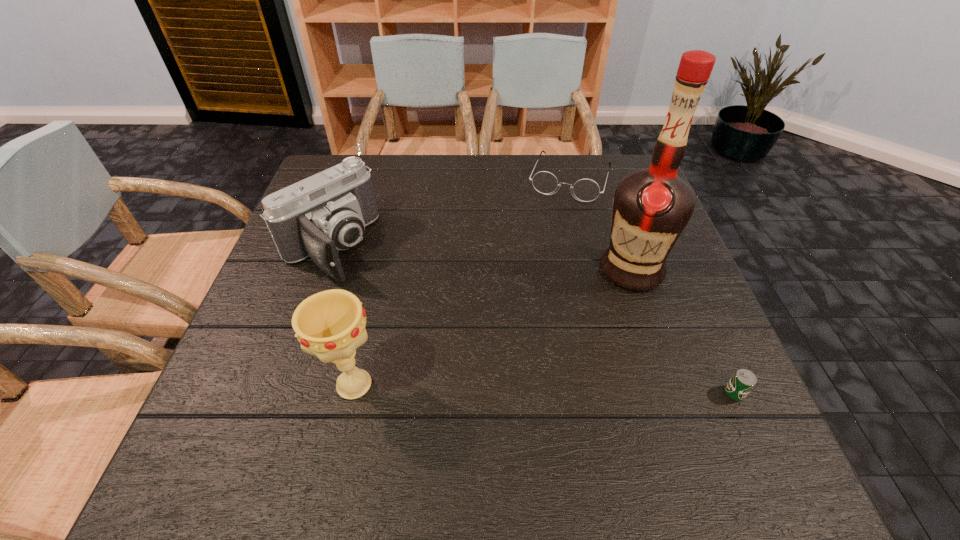
In order to click on vacant space on the desktop that is between the chalice and the shortest object and is positioned at the front of the camera with an open lens cover in this screenshot , I will do `click(490, 388)`.

In order to click on vacant space on the desktop that is between the chalice and the beer can and is positioned on the front and back of the tallest object in this screenshot , I will do coord(492,388).

This screenshot has height=540, width=960. I want to click on free spot on the desktop that is between the chalice and the beer can and is positioned on the front-facing side of the farthest object, so click(x=496, y=388).